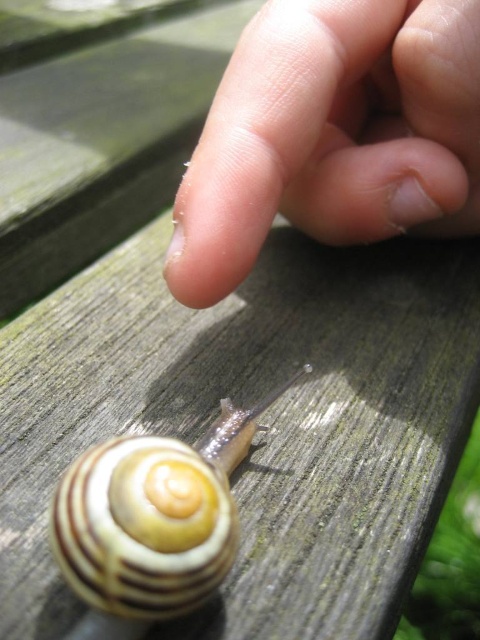
Is point (421, 3) behind point (217, 570)?

Yes, point (421, 3) is behind point (217, 570).

Does pale skin at upper center have a greater height compared to striped shell snail at lower left?

Correct, pale skin at upper center is much taller as striped shell snail at lower left.

Which is behind, point (431, 74) or point (191, 496)?

Point (431, 74)

The image size is (480, 640). I want to click on pale skin at upper center, so click(x=333, y=134).